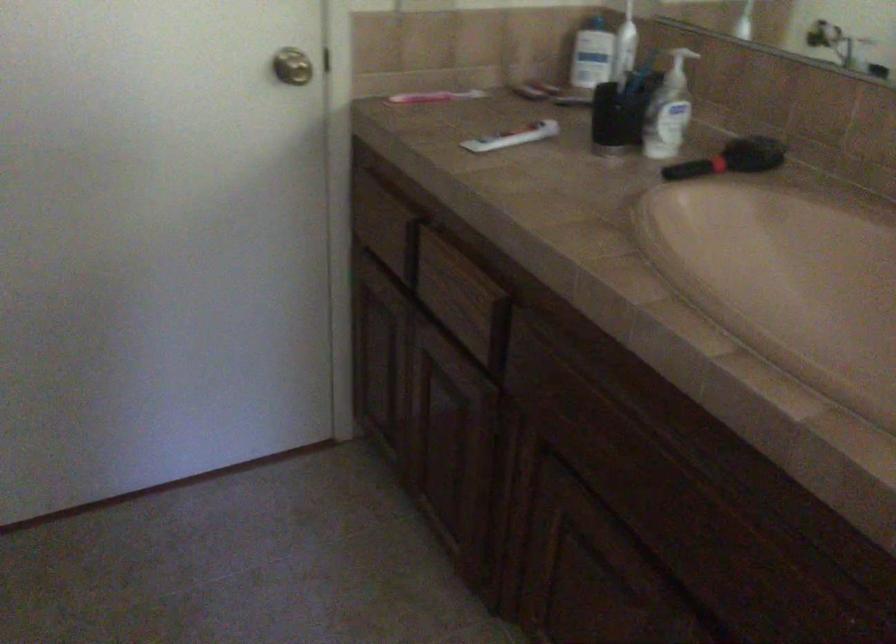
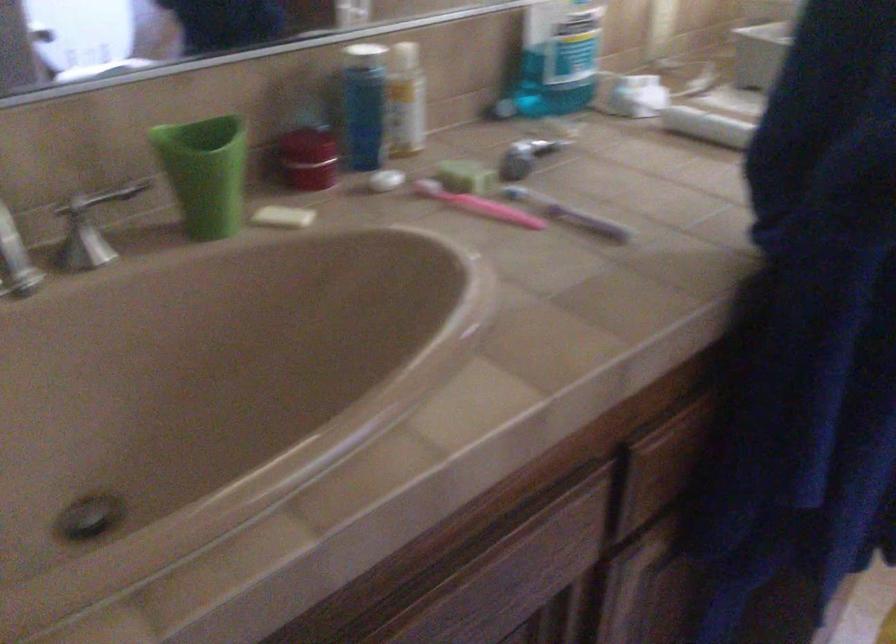
Consider the image. How did the camera likely rotate?

The rotation direction of the camera is right-down.